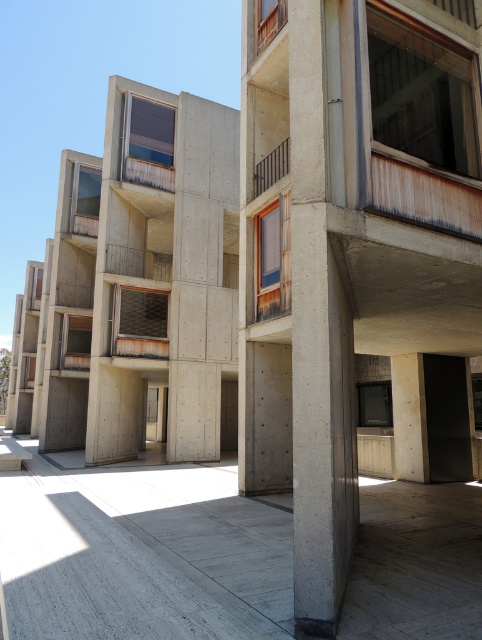
Question: Estimate the real-world distances between objects in this image. Which object is farther from the rustic metal balcony at upper center?

Choices:
 (A) gray concrete at center
 (B) concrete at center

Answer: (A)

Question: Can you confirm if gray concrete at center is positioned to the left of rustic metal balcony at upper center?

Choices:
 (A) no
 (B) yes

Answer: (B)

Question: Which of these objects is positioned closest to the gray concrete at center?

Choices:
 (A) concrete/rough column at center
 (B) rustic metal balcony at upper center

Answer: (A)

Question: Which point is closer to the camera taking this photo?

Choices:
 (A) (419, 480)
 (B) (285, 150)

Answer: (B)

Question: Does gray concrete at center appear under concrete/rough column at center?

Choices:
 (A) yes
 (B) no

Answer: (A)

Question: Is concrete/rough column at center above concrete at center?

Choices:
 (A) yes
 (B) no

Answer: (A)